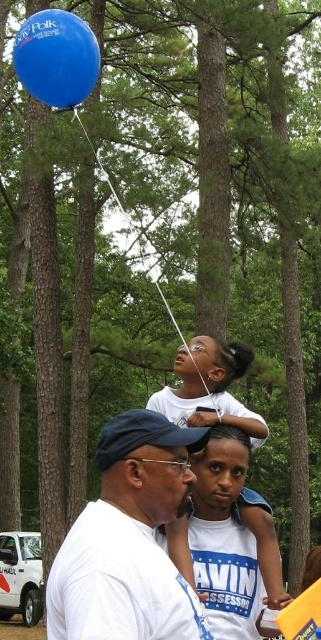
Which is more to the right, blue cotton shirt at center or blue rubber balloon at upper left?

blue cotton shirt at center

The image size is (321, 640). I want to click on blue cotton shirt at center, so pos(225,538).

Can you confirm if blue rubber balloon at upper left is positioned to the left of blue rubber balloon at upper center?

Yes, blue rubber balloon at upper left is to the left of blue rubber balloon at upper center.

Is blue rubber balloon at upper left to the right of blue rubber balloon at upper center from the viewer's perspective?

In fact, blue rubber balloon at upper left is to the left of blue rubber balloon at upper center.

Where is `blue rubber balloon at upper left`? blue rubber balloon at upper left is located at coordinates (57, 58).

Can you confirm if blue cotton shirt at center is thinner than blue rubber balloon at upper center?

Yes, blue cotton shirt at center is thinner than blue rubber balloon at upper center.

Which is below, blue cotton shirt at center or blue rubber balloon at upper center?

Positioned lower is blue cotton shirt at center.

This screenshot has height=640, width=321. Describe the element at coordinates (225, 538) in the screenshot. I see `blue cotton shirt at center` at that location.

Where is `blue cotton shirt at center`? Image resolution: width=321 pixels, height=640 pixels. blue cotton shirt at center is located at coordinates (225, 538).